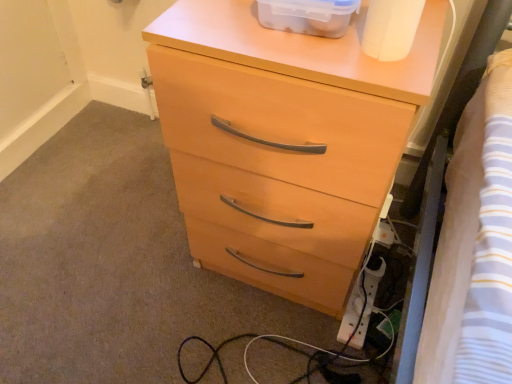
Image resolution: width=512 pixels, height=384 pixels. In order to click on white plastic extension cord at lower right in this screenshot , I will do `click(360, 307)`.

At what (x,y) coordinates should I click in order to perform the action: click on matte wood chest of drawers at center. Please return your answer as a coordinate pair (x, y). Looking at the image, I should click on (282, 143).

What do you see at coordinates (282, 143) in the screenshot?
I see `matte wood chest of drawers at center` at bounding box center [282, 143].

You are a GUI agent. You are given a task and a screenshot of the screen. Output one action in this format:
    pyautogui.click(x=<x>, y=<y>)
    Task: Click on the white matte toilet paper at upper right
    
    Given the screenshot: What is the action you would take?
    pyautogui.click(x=391, y=28)

Which is closer, (296,26) or (376,23)?

Point (296,26) is farther from the camera than point (376,23).

Looking at their sizes, would you say translucent plastic container at upper center is wider or thinner than white matte toilet paper at upper right?

In the image, translucent plastic container at upper center appears to be wider than white matte toilet paper at upper right.

Looking at this image, is translucent plastic container at upper center completely or partially outside of white matte toilet paper at upper right?

Indeed, translucent plastic container at upper center is completely outside white matte toilet paper at upper right.

From the image's perspective, is translucent plastic container at upper center under white matte toilet paper at upper right?

Actually, translucent plastic container at upper center appears above white matte toilet paper at upper right in the image.

In the scene shown: From the image's perspective, between white plastic extension cord at lower right and translucent plastic container at upper center, who is located below?

white plastic extension cord at lower right appears lower in the image.

Is white plastic extension cord at lower right oriented away from translucent plastic container at upper center?

No, translucent plastic container at upper center is not at the back of white plastic extension cord at lower right.

Is point (360, 336) closer or farther from the camera than point (290, 15)?

Clearly, point (360, 336) is more distant from the camera than point (290, 15).

Is white plastic extension cord at lower right to the right of translucent plastic container at upper center from the viewer's perspective?

Yes, white plastic extension cord at lower right is to the right of translucent plastic container at upper center.

From a real-world perspective, is translucent plastic container at upper center on matte wood chest of drawers at center?

Yes, from a real-world perspective, translucent plastic container at upper center is above matte wood chest of drawers at center.

Is translucent plastic container at upper center not within matte wood chest of drawers at center?

Indeed, translucent plastic container at upper center is completely outside matte wood chest of drawers at center.

Consider the image. Considering the positions of objects translucent plastic container at upper center and matte wood chest of drawers at center in the image provided, who is more to the right, translucent plastic container at upper center or matte wood chest of drawers at center?

translucent plastic container at upper center.

From a real-world perspective, does white matte toilet paper at upper right stand above white plastic extension cord at lower right?

Yes, from a real-world perspective, white matte toilet paper at upper right is above white plastic extension cord at lower right.

Is white matte toilet paper at upper right inside or outside of white plastic extension cord at lower right?

white matte toilet paper at upper right lies outside white plastic extension cord at lower right.

The height and width of the screenshot is (384, 512). I want to click on toilet paper located above the white plastic extension cord at lower right (from a real-world perspective), so click(391, 28).

Between white matte toilet paper at upper right and white plastic extension cord at lower right, which one has less height?

white plastic extension cord at lower right is shorter.

From a real-world perspective, is matte wood chest of drawers at center below white matte toilet paper at upper right?

Yes.

From the image's perspective, is matte wood chest of drawers at center located above white matte toilet paper at upper right?

No, from the image's perspective, matte wood chest of drawers at center is not above white matte toilet paper at upper right.

Can white matte toilet paper at upper right be found inside matte wood chest of drawers at center?

No.

Is matte wood chest of drawers at center surrounding white plastic extension cord at lower right?

Definitely not — white plastic extension cord at lower right is not inside matte wood chest of drawers at center.

Who is taller, matte wood chest of drawers at center or white plastic extension cord at lower right?

matte wood chest of drawers at center.

Based on their positions, is matte wood chest of drawers at center located to the left or right of white plastic extension cord at lower right?

From the image, it's evident that matte wood chest of drawers at center is to the left of white plastic extension cord at lower right.

Does point (307, 205) come behind point (355, 313)?

No, (307, 205) is closer to viewer.

Could you measure the distance between matte wood chest of drawers at center and translucent plastic container at upper center?

matte wood chest of drawers at center and translucent plastic container at upper center are 10.81 inches apart.

Considering the relative sizes of matte wood chest of drawers at center and translucent plastic container at upper center in the image provided, is matte wood chest of drawers at center bigger than translucent plastic container at upper center?

Correct, matte wood chest of drawers at center is larger in size than translucent plastic container at upper center.

From a real-world perspective, which object rests below the other?

matte wood chest of drawers at center, from a real-world perspective.

In terms of width, does matte wood chest of drawers at center look wider or thinner when compared to translucent plastic container at upper center?

matte wood chest of drawers at center is wider than translucent plastic container at upper center.

Locate an element on the screen. This screenshot has height=384, width=512. toilet paper above the translucent plastic container at upper center (from a real-world perspective) is located at coordinates (391, 28).

The height and width of the screenshot is (384, 512). In order to click on extension cord on the right of translucent plastic container at upper center in this screenshot , I will do `click(360, 307)`.

From the picture: From the image, which object appears to be farther from white plastic extension cord at lower right, white matte toilet paper at upper right or translucent plastic container at upper center?

Based on the image, translucent plastic container at upper center appears to be further to white plastic extension cord at lower right.

Looking at the image, which one is located closer to white plastic extension cord at lower right, white matte toilet paper at upper right or matte wood chest of drawers at center?

matte wood chest of drawers at center lies closer to white plastic extension cord at lower right than the other object.

Based on their spatial positions, is matte wood chest of drawers at center or translucent plastic container at upper center closer to white matte toilet paper at upper right?

Based on the image, translucent plastic container at upper center appears to be nearer to white matte toilet paper at upper right.

Based on their spatial positions, is matte wood chest of drawers at center or white plastic extension cord at lower right closer to translucent plastic container at upper center?

The object closer to translucent plastic container at upper center is matte wood chest of drawers at center.

Which object lies nearer to the anchor point matte wood chest of drawers at center, white plastic extension cord at lower right or translucent plastic container at upper center?

translucent plastic container at upper center is positioned closer to the anchor matte wood chest of drawers at center.

Which object lies further to the anchor point white matte toilet paper at upper right, translucent plastic container at upper center or white plastic extension cord at lower right?

white plastic extension cord at lower right.

Looking at the image, which one is located further to white plastic extension cord at lower right, matte wood chest of drawers at center or translucent plastic container at upper center?

translucent plastic container at upper center is positioned further to the anchor white plastic extension cord at lower right.

Which object lies further to the anchor point white matte toilet paper at upper right, white plastic extension cord at lower right or translucent plastic container at upper center?

white plastic extension cord at lower right lies further to white matte toilet paper at upper right than the other object.

Locate an element on the screen. The image size is (512, 384). toilet paper between translucent plastic container at upper center and matte wood chest of drawers at center from top to bottom is located at coordinates (391, 28).

Where is `the chest of drawers that lies between translucent plastic container at upper center and white plastic extension cord at lower right from top to bottom`? The width and height of the screenshot is (512, 384). the chest of drawers that lies between translucent plastic container at upper center and white plastic extension cord at lower right from top to bottom is located at coordinates pos(282,143).

At what (x,y) coordinates should I click in order to perform the action: click on toilet paper between translucent plastic container at upper center and white plastic extension cord at lower right in the up-down direction. Please return your answer as a coordinate pair (x, y). Looking at the image, I should click on (391, 28).

Locate an element on the screen. Image resolution: width=512 pixels, height=384 pixels. chest of drawers between white matte toilet paper at upper right and white plastic extension cord at lower right from front to back is located at coordinates (282, 143).